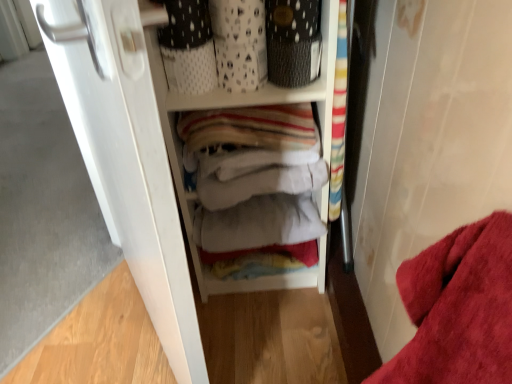
Image resolution: width=512 pixels, height=384 pixels. In order to click on white fabric at center in this screenshot , I will do `click(248, 105)`.

The image size is (512, 384). What do you see at coordinates (293, 61) in the screenshot? I see `textured black basket at upper center` at bounding box center [293, 61].

Find the location of `white fabric at center`. white fabric at center is located at coordinates 248,105.

From their relative heights in the image, would you say white matte door at left is taller or shorter than white fabric at center?

In the image, white matte door at left appears to be taller than white fabric at center.

Considering the relative positions of white matte door at left and white fabric at center in the image provided, is white matte door at left to the right of white fabric at center from the viewer's perspective?

Incorrect, white matte door at left is not on the right side of white fabric at center.

Is point (121, 198) closer or farther from the camera than point (227, 99)?

Point (121, 198) is closer to the camera than point (227, 99).

Is white matte door at left bigger than white fabric at center?

Yes.

Considering the sizes of white fabric at center and white matte door at left in the image, is white fabric at center taller or shorter than white matte door at left?

Clearly, white fabric at center is shorter compared to white matte door at left.

Does white fabric at center lie in front of white matte door at left?

No, it is behind white matte door at left.

Is white fabric at center positioned far away from white matte door at left?

That's not correct — white fabric at center is a little close to white matte door at left.

From a real-world perspective, is white fabric at center physically above white matte door at left?

Incorrect, from a real-world perspective, white fabric at center is lower than white matte door at left.

Would you say white fabric at center is inside or outside textured black basket at upper center?

white fabric at center cannot be found inside textured black basket at upper center.

Considering the relative positions of white fabric at center and textured black basket at upper center in the image provided, is white fabric at center to the left or to the right of textured black basket at upper center?

white fabric at center is to the left of textured black basket at upper center.

Measure the distance between white fabric at center and textured black basket at upper center.

9.00 inches.

Is white matte door at left positioned before textured black basket at upper center?

Yes.

Is point (106, 85) positioned after point (295, 75)?

No, (106, 85) is closer to viewer.

From the image's perspective, which object appears higher, white matte door at left or textured black basket at upper center?

From the image's view, textured black basket at upper center is above.

I want to click on basket located on the right of white matte door at left, so click(x=293, y=61).

Is textured black basket at upper center aimed at white fabric at center?

Yes, textured black basket at upper center is oriented towards white fabric at center.

Considering the relative positions of textured black basket at upper center and white fabric at center in the image provided, is textured black basket at upper center to the left of white fabric at center from the viewer's perspective?

In fact, textured black basket at upper center is to the right of white fabric at center.

Find the location of a particular element. The width and height of the screenshot is (512, 384). basket that is above the white fabric at center (from the image's perspective) is located at coordinates click(293, 61).

Which object is further away from the camera, textured black basket at upper center or white fabric at center?

Positioned behind is textured black basket at upper center.

Considering the relative sizes of textured black basket at upper center and white matte door at left in the image provided, is textured black basket at upper center bigger than white matte door at left?

Incorrect, textured black basket at upper center is not larger than white matte door at left.

Is textured black basket at upper center with white matte door at left?

No, textured black basket at upper center is not with white matte door at left.

Is textured black basket at upper center positioned before white matte door at left?

No, it is not.

Is textured black basket at upper center aimed at white matte door at left?

No, textured black basket at upper center is not oriented towards white matte door at left.

Where is `cabinetry above the white matte door at left (from the image's perspective)`? The height and width of the screenshot is (384, 512). cabinetry above the white matte door at left (from the image's perspective) is located at coordinates click(248, 105).

Locate an element on the screen. This screenshot has height=384, width=512. cabinetry lying behind the white matte door at left is located at coordinates (248, 105).

Looking at the image, which one is located closer to textured black basket at upper center, white matte door at left or white fabric at center?

white fabric at center.

Based on the photo, which object lies further to the anchor point white matte door at left, white fabric at center or textured black basket at upper center?

textured black basket at upper center is positioned further to the anchor white matte door at left.

Estimate the real-world distances between objects in this image. Which object is closer to textured black basket at upper center, white fabric at center or white matte door at left?

white fabric at center is closer to textured black basket at upper center.

When comparing their distances from white fabric at center, does textured black basket at upper center or white matte door at left seem further?

Based on the image, white matte door at left appears to be further to white fabric at center.

Which object lies further to the anchor point white matte door at left, textured black basket at upper center or white fabric at center?

textured black basket at upper center lies further to white matte door at left than the other object.

Estimate the real-world distances between objects in this image. Which object is further from white fabric at center, white matte door at left or textured black basket at upper center?

Based on the image, white matte door at left appears to be further to white fabric at center.

Find the location of `cabinetry positioned between white matte door at left and textured black basket at upper center from near to far`. cabinetry positioned between white matte door at left and textured black basket at upper center from near to far is located at coordinates (248, 105).